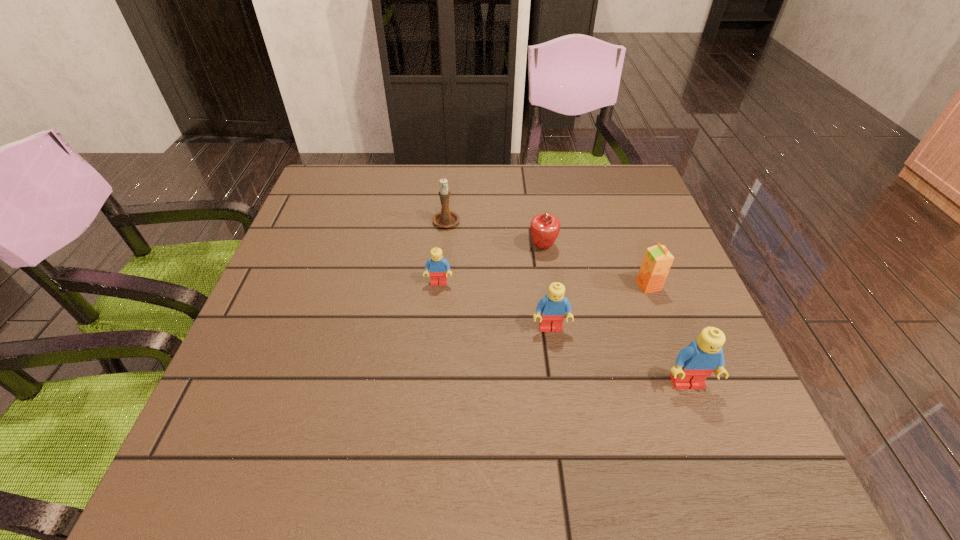
You are a GUI agent. You are given a task and a screenshot of the screen. Output one action in this format:
    pyautogui.click(x=<x>, y=<y>)
    Task: Click on the shortest Lego
    This screenshot has height=540, width=960.
    Given the screenshot: What is the action you would take?
    pos(437,265)

This screenshot has width=960, height=540. Identify the location of the leftmost Lego. (437, 265).

Locate an element on the screen. the second Lego from left to right is located at coordinates (553, 307).

Locate an element on the screen. The image size is (960, 540). the second shortest Lego is located at coordinates (553, 307).

At what (x,y) coordinates should I click in order to perform the action: click on the nearest object. Please return your answer as a coordinate pair (x, y). The image size is (960, 540). Looking at the image, I should click on (694, 363).

The image size is (960, 540). Find the location of `the rightmost Lego`. the rightmost Lego is located at coordinates (694, 363).

Locate an element on the screen. apple is located at coordinates (544, 228).

I want to click on orange juice, so click(657, 261).

The image size is (960, 540). I want to click on candle holder, so click(x=446, y=218).

At what (x,y) coordinates should I click in order to perform the action: click on vacant point located on the face of the shortest Lego. Please return your answer as a coordinate pair (x, y). Image resolution: width=960 pixels, height=540 pixels. Looking at the image, I should click on (436, 318).